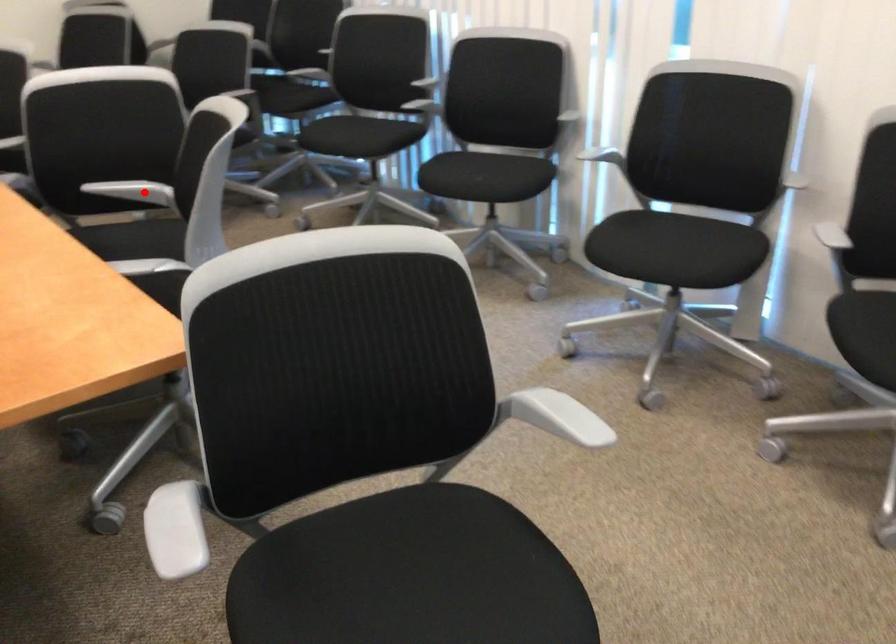
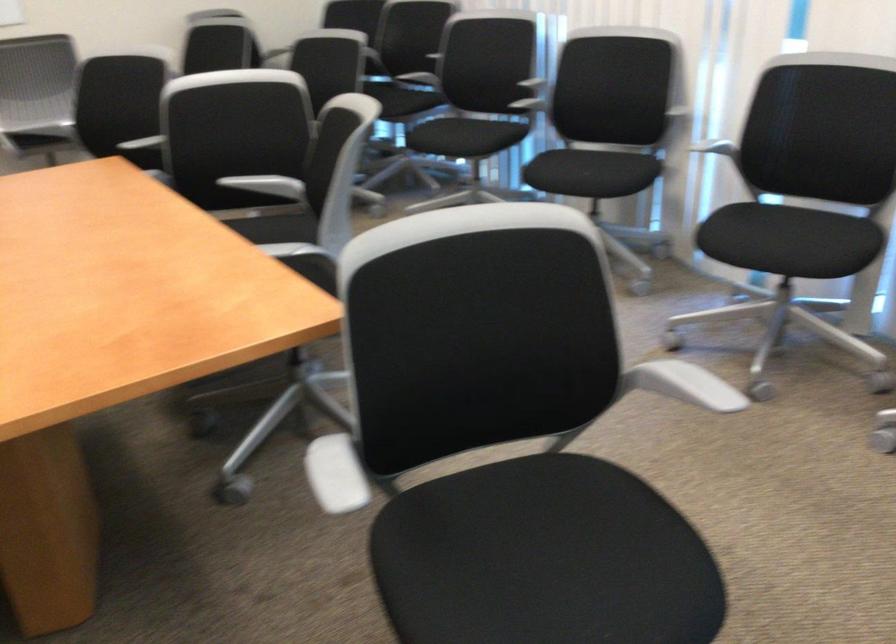
Find the pixel in the second image that matches the highlighted location in the first image.

(268, 185)